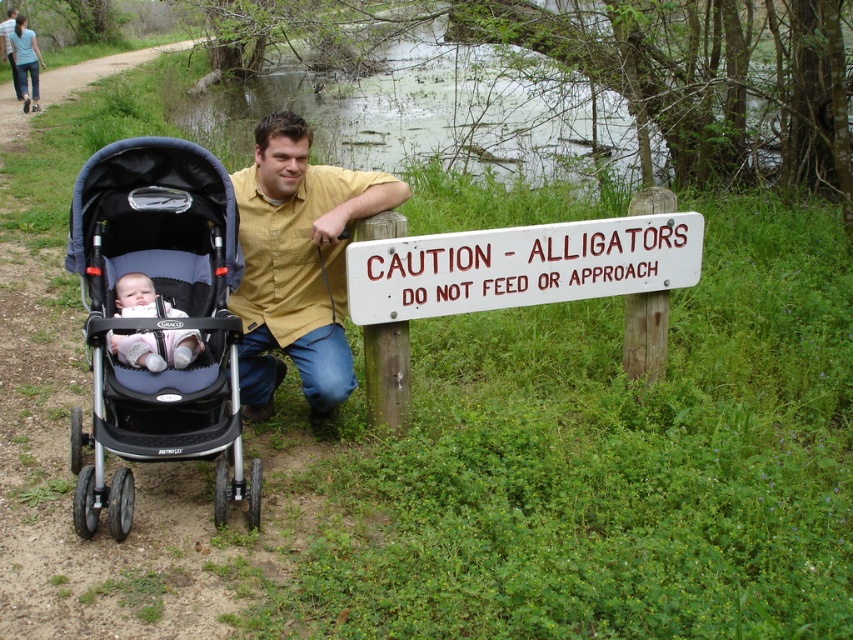
Does white painted wood sign at center appear on the left side of soft pink fabric baby at center?

No, white painted wood sign at center is not to the left of soft pink fabric baby at center.

Does white painted wood sign at center have a smaller size compared to soft pink fabric baby at center?

No.

Is point (657, 227) less distant than point (119, 342)?

No, (657, 227) is further to viewer.

Image resolution: width=853 pixels, height=640 pixels. Identify the location of white painted wood sign at center. (520, 266).

Describe the element at coordinates (160, 321) in the screenshot. I see `black fabric stroller at left` at that location.

Consider the image. Does black fabric stroller at left have a greater height compared to yellow shirt at center?

Yes.

In the scene shown: Who is more forward, (x=102, y=193) or (x=321, y=410)?

Point (x=102, y=193) is more forward.

At what (x,y) coordinates should I click in order to perform the action: click on black fabric stroller at left. Please return your answer as a coordinate pair (x, y). Looking at the image, I should click on (160, 321).

Is yellow shirt at center shorter than white painted wood sign at center?

Incorrect, yellow shirt at center's height does not fall short of white painted wood sign at center's.

Who is positioned more to the right, yellow shirt at center or white painted wood sign at center?

From the viewer's perspective, white painted wood sign at center appears more on the right side.

Does point (317, 243) come in front of point (444, 250)?

Yes, it is in front of point (444, 250).

At what (x,y) coordinates should I click in order to perform the action: click on yellow shirt at center. Please return your answer as a coordinate pair (x, y). This screenshot has width=853, height=640. Looking at the image, I should click on (297, 264).